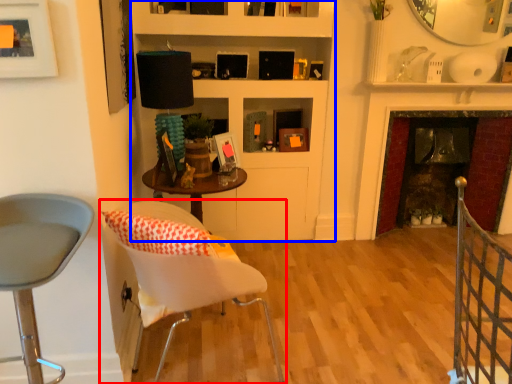
Question: Which object is further to the camera taking this photo, chair (highlighted by a red box) or bookshelf (highlighted by a blue box)?

Choices:
 (A) chair
 (B) bookshelf

Answer: (B)